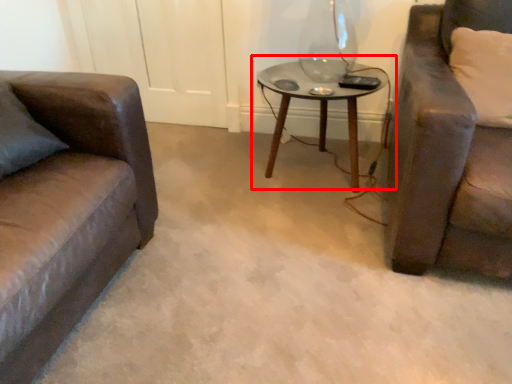
Question: From the image's perspective, considering the relative positions of table (annotated by the red box) and pillow in the image provided, where is table (annotated by the red box) located with respect to the staircase?

Choices:
 (A) below
 (B) above

Answer: (A)